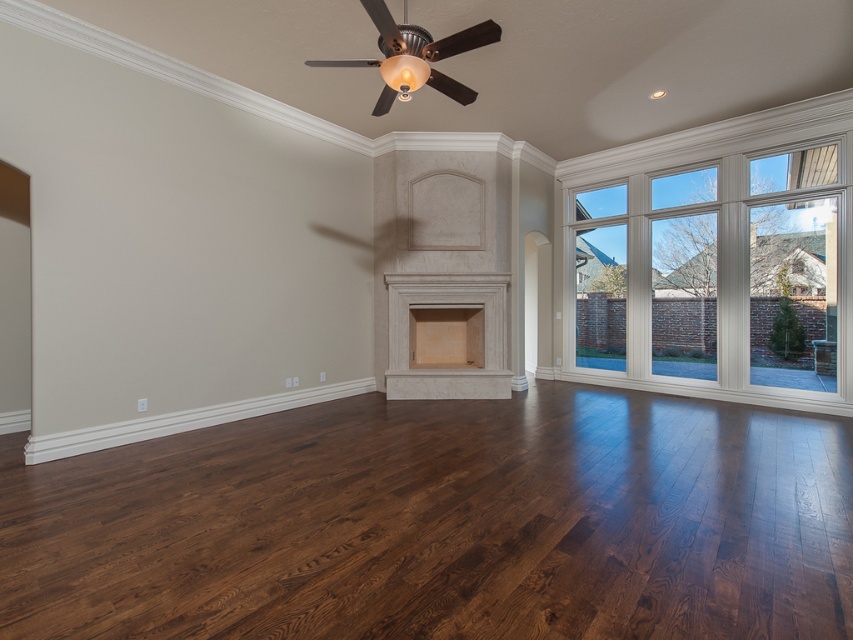
You are standing in the room and want to place a decorative item on the closest fireplace. Which fireplace should you choose between the matte stone fireplace at center and the matte beige fireplace at center?

You should choose the matte stone fireplace at center because it is closer to the viewer than the matte beige fireplace at center.